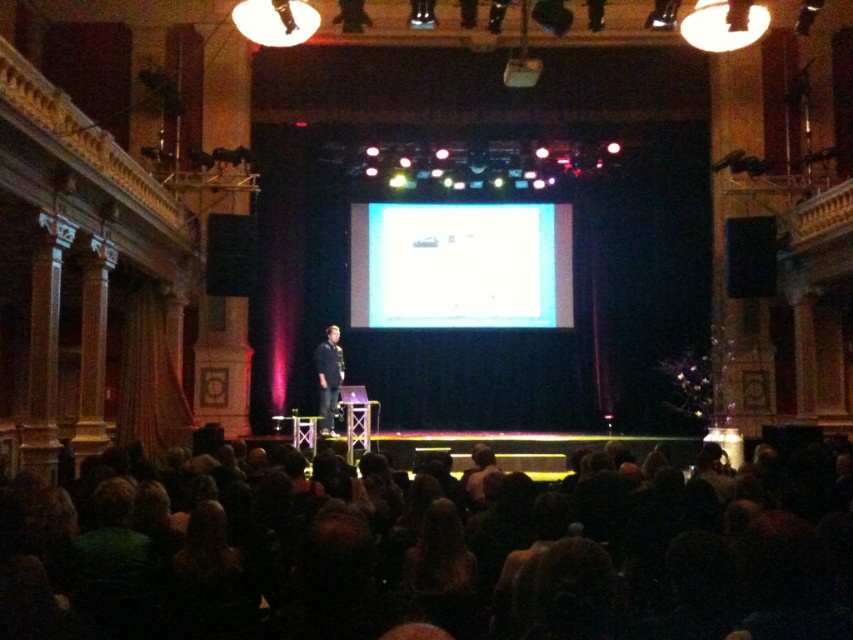
Question: Does dark brown hair at lower center lie behind dark gray shirt at center?

Choices:
 (A) yes
 (B) no

Answer: (B)

Question: Among these points, which one is nearest to the camera?

Choices:
 (A) (756, 225)
 (B) (547, 602)

Answer: (B)

Question: From the image, what is the correct spatial relationship of dark brown hair at lower center in relation to dark gray shirt at center?

Choices:
 (A) right
 (B) left

Answer: (A)

Question: Is dark brown hair at lower center closer to the viewer compared to dark gray shirt at center?

Choices:
 (A) no
 (B) yes

Answer: (B)

Question: Which object is the closest to the white glossy screen at center?

Choices:
 (A) dark brown hair at lower center
 (B) black matte speaker at center
 (C) dark gray shirt at center

Answer: (B)

Question: Which object is the farthest from the dark gray shirt at center?

Choices:
 (A) black matte speaker at center
 (B) white glossy screen at center

Answer: (A)